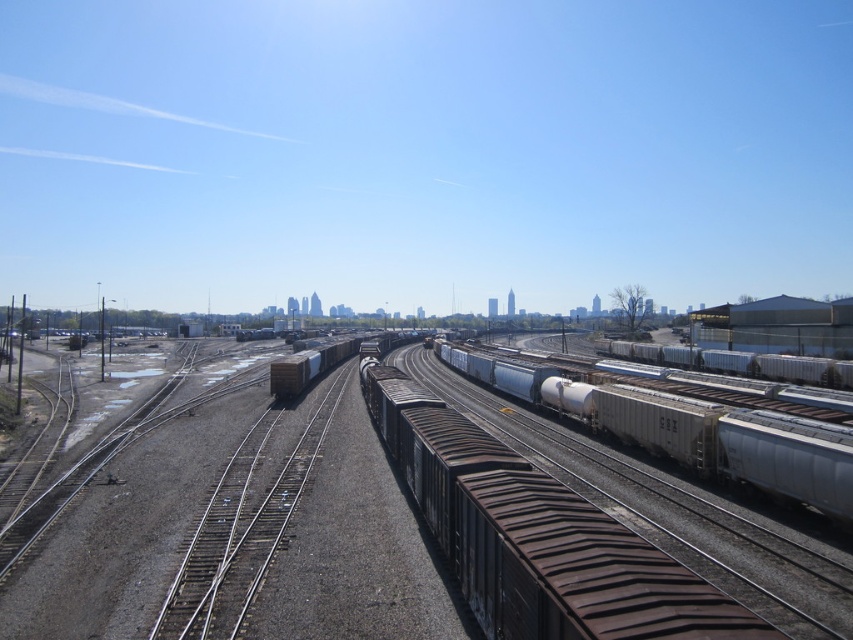
Question: Can you confirm if metallic silver tank car at center is positioned below brown matte container at center?

Choices:
 (A) no
 (B) yes

Answer: (B)

Question: Does rusty metal track at center have a larger size compared to brown matte container at center?

Choices:
 (A) yes
 (B) no

Answer: (A)

Question: Which point is farther to the camera?

Choices:
 (A) (265, 541)
 (B) (761, 486)

Answer: (B)

Question: Is metallic silver tank car at center positioned at the back of brown matte container at center?

Choices:
 (A) yes
 (B) no

Answer: (B)

Question: Estimate the real-world distances between objects in this image. Which object is closer to the rusty metal track at center?

Choices:
 (A) metallic silver tank car at center
 (B) brown matte container at center

Answer: (A)

Question: Considering the real-world distances, which object is closest to the metallic silver tank car at center?

Choices:
 (A) brown matte container at center
 (B) rusty metal track at center

Answer: (B)